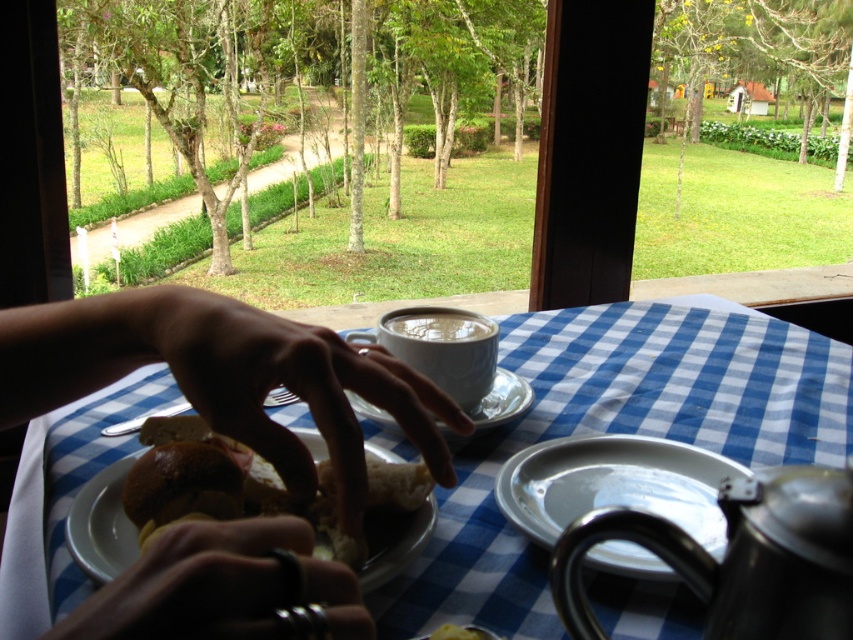
You are a chef observing an outdoor dining scene through a window. You notice the matte skin hand at center and the metallic ring at lower center. Which object is taller?

The matte skin hand at center is taller than the metallic ring at lower center.

Looking at this image, you are a photographer trying to capture a closeup shot of the matte skin hand at center. The camera you are using has a minimum focusing distance of 30 centimeters. Can you take the photo without moving the hand or the camera?

The distance of matte skin hand at center from camera is 32.40 centimeters, which is greater than the camera minimum focusing distance of 30 centimeters. Therefore, you can take the photo without moving the hand or the camera.

In the scene shown: You are standing in front of the window looking at the outdoor dining scene. There are two points marked on the table surface. Which point is closer to you, point 1 at coordinates point (379, 412) or point 2 at coordinates point (428, 328)?

Point 1 at coordinates point (379, 412) is closer to you than point 2 at coordinates point (428, 328).